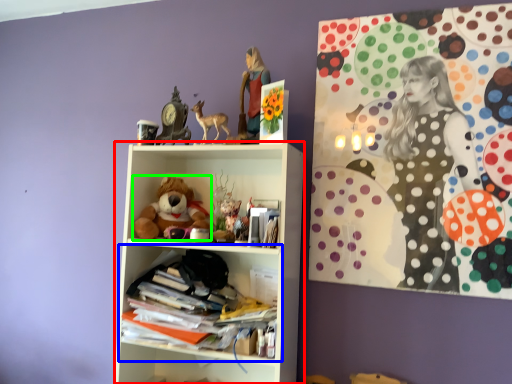
Question: Based on their relative distances, which object is farther from shelf (highlighted by a red box)? Choose from shelf (highlighted by a blue box) and teddy bear (highlighted by a green box).

Choices:
 (A) shelf
 (B) teddy bear

Answer: (B)